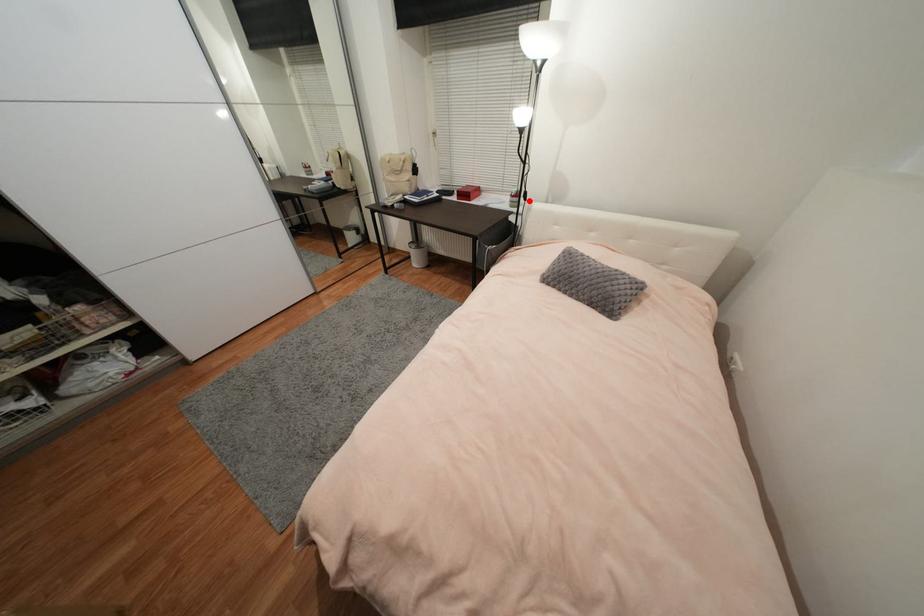
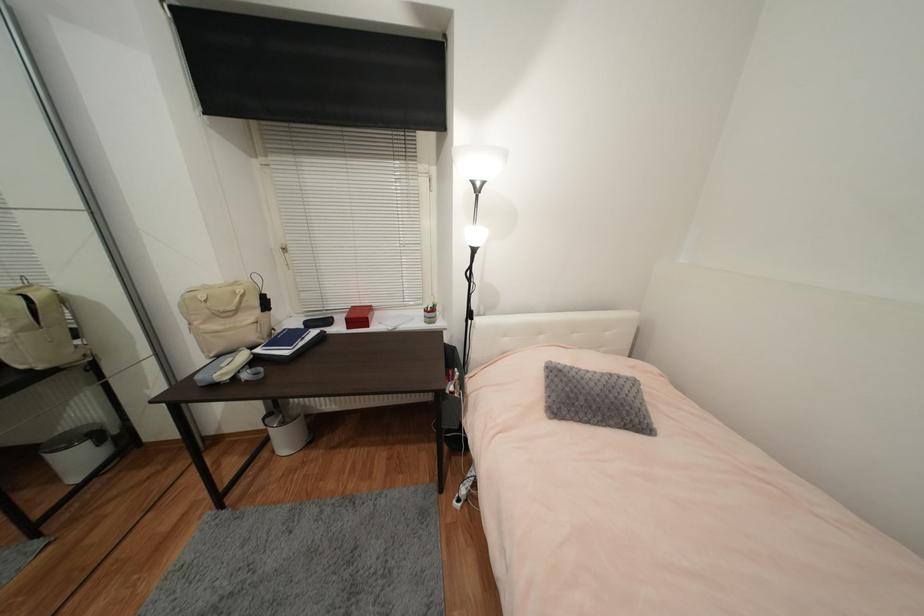
Find the pixel in the second image that matches the highlighted location in the first image.

(477, 320)